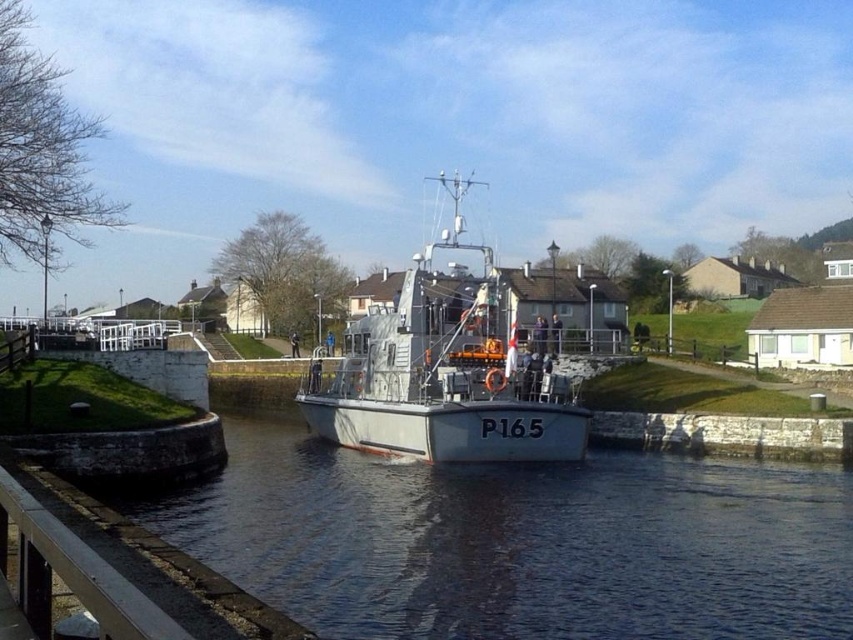
You are a drone operator trying to capture a clear image of the military patrol boat P165. Your drone is currently hovering at point [520,541]. What is the nearest object to your current position?

The nearest object to the point [520,541] is the white smooth water at center, as it is located exactly at that coordinate.

Consider the image. You are a drone operator trying to capture a photo of the metallic gray boat at center. The drone is currently hovering above the white smooth water at center. Can you safely descend to take the photo without hitting the boat?

The white smooth water at center is not as tall as metallic gray boat at center, so the drone cannot safely descend because the boat is taller than the water surface. The drone might collide with the boat if it descends to the water level.